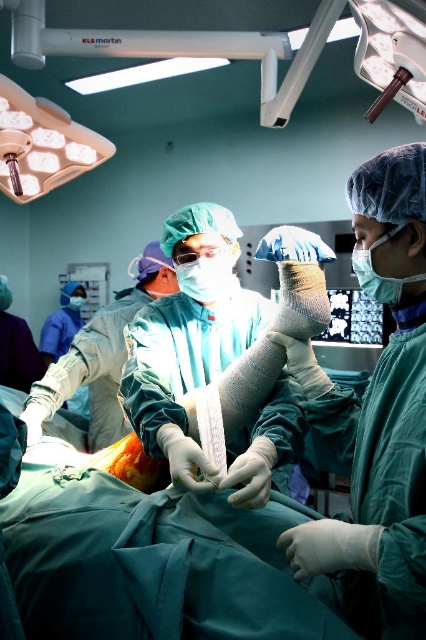
You are a medical student observing the surgery. You need to locate the white bandaged hand at center for a procedure. Where exactly is it located in the operating room?

The white bandaged hand at center is located at point (204,360) in the operating room.